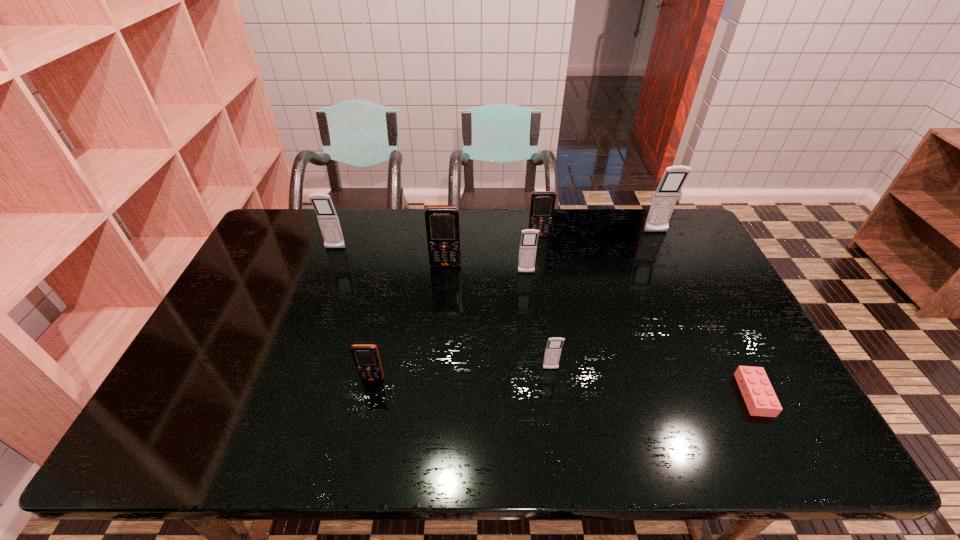
The image size is (960, 540). What are the coordinates of `the tallest object` in the screenshot? It's located at (665, 197).

Image resolution: width=960 pixels, height=540 pixels. Identify the location of the rightmost gray cellular telephone. pos(665,197).

At what (x,y) coordinates should I click in order to perform the action: click on the third farthest cellular telephone. Please return your answer as a coordinate pair (x, y). This screenshot has height=540, width=960. Looking at the image, I should click on tap(327, 217).

Identify the location of the sixth nearest object. (327, 217).

Find the location of a particular element. This screenshot has width=960, height=540. the fourth farthest cellular telephone is located at coordinates (442, 223).

The height and width of the screenshot is (540, 960). Find the location of `the sixth object from right to left`. the sixth object from right to left is located at coordinates (442, 223).

Locate an element on the screen. the third biggest gray cellular telephone is located at coordinates (528, 244).

Locate an element on the screen. the fifth farthest cellular telephone is located at coordinates (528, 244).

Locate an element on the screen. the farthest orange cellular telephone is located at coordinates (542, 205).

Locate an element on the screen. This screenshot has height=540, width=960. the rightmost orange cellular telephone is located at coordinates (542, 205).